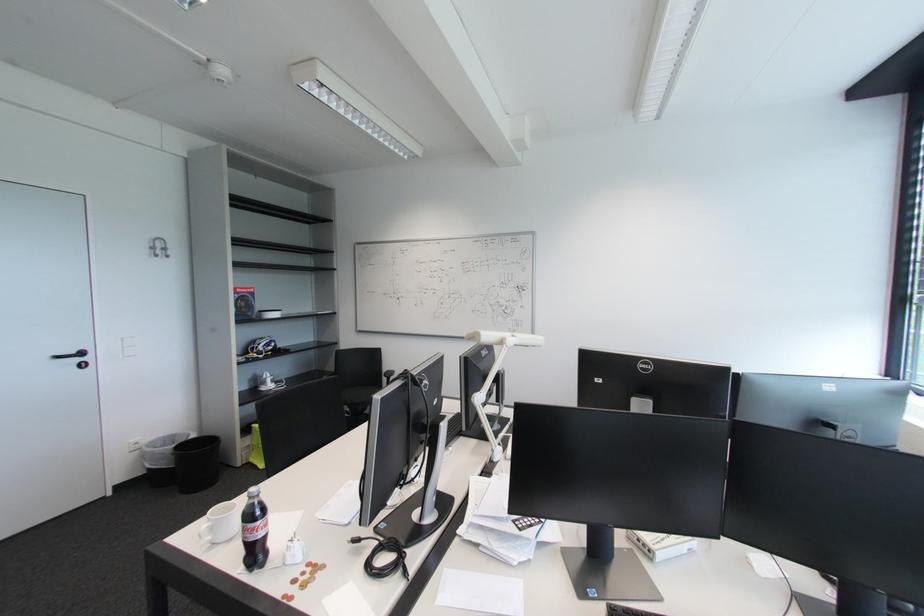
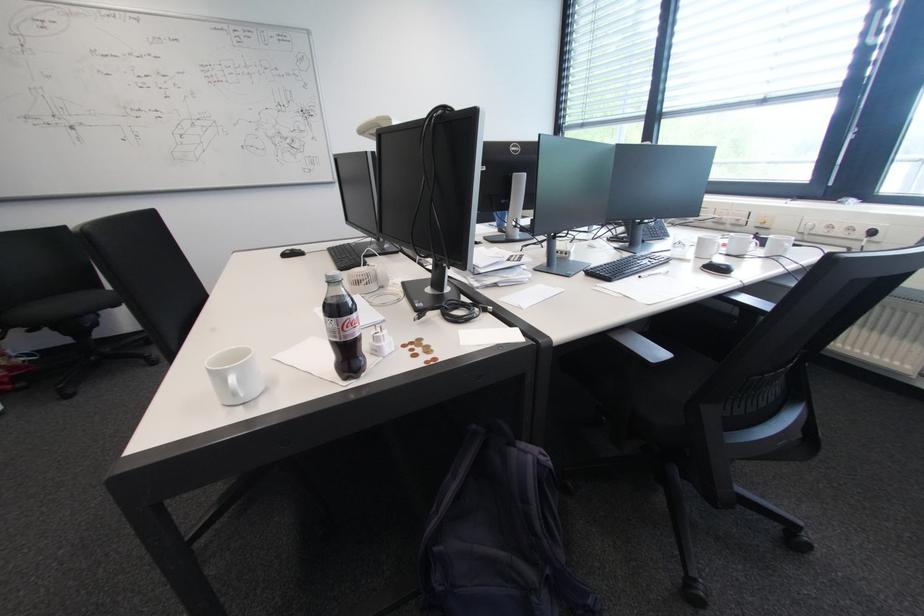
How did the camera likely rotate?

The rotation direction of the camera is right-down.